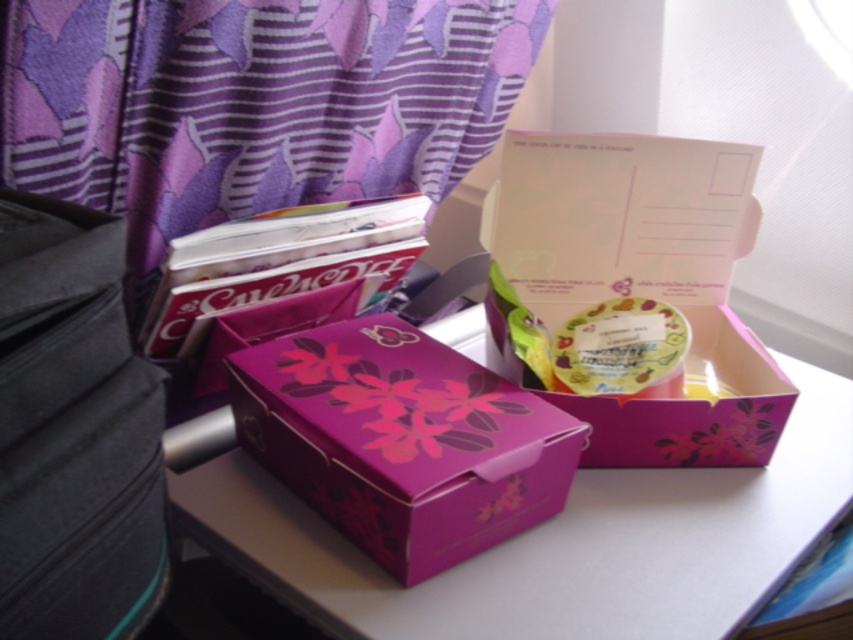
Question: Which point is farther to the camera?

Choices:
 (A) pink glossy box at center
 (B) purple cardboard box at center

Answer: (A)

Question: Does matte pink gift box at center appear on the right side of translucent floral soap at center?

Choices:
 (A) no
 (B) yes

Answer: (A)

Question: Which point is farther to the camera?

Choices:
 (A) purple cardboard box at center
 (B) black fabric bag at left
 (C) matte pink gift box at center

Answer: (A)

Question: From the image, what is the correct spatial relationship of purple cardboard box at center in relation to black fabric bag at left?

Choices:
 (A) below
 (B) above

Answer: (A)

Question: Which object is farther from the camera taking this photo?

Choices:
 (A) matte pink gift box at center
 (B) pink glossy box at center

Answer: (B)

Question: Is matte pink gift box at center smaller than translucent floral soap at center?

Choices:
 (A) yes
 (B) no

Answer: (B)